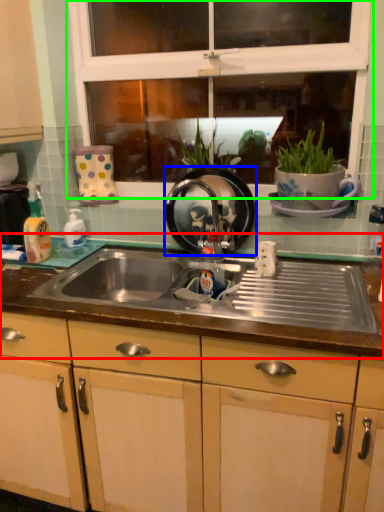
Question: Considering the real-world distances, which object is closest to countertop (highlighted by a red box)? appliance (highlighted by a blue box) or window (highlighted by a green box).

Choices:
 (A) appliance
 (B) window

Answer: (A)